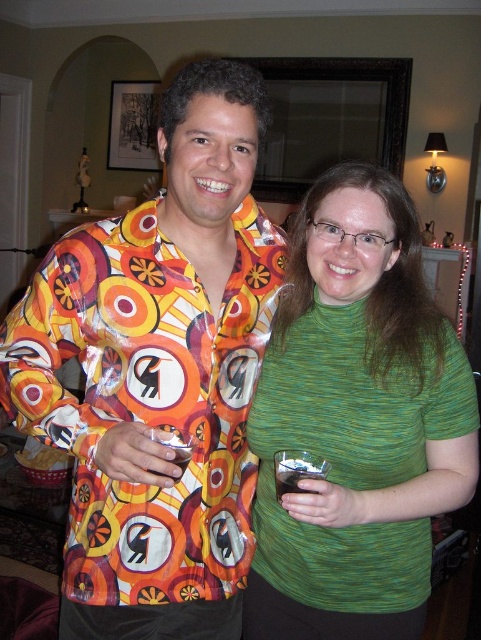
You are standing in the living room and want to find the green knit turtleneck at center. According to the coordinates provided, where should you look relative to the image frame?

The green knit turtleneck at center is located at coordinates point 0.659 on the x axis and 0.742 on the y axis relative to the image frame.

You are a photographer taking a picture of the green knit turtleneck at center and the transparent plastic wine glass at lower center. Which object is positioned closer to your camera lens?

The green knit turtleneck at center is closer to the viewer than the transparent plastic wine glass at lower center, so the green knit turtleneck at center is positioned closer to the camera lens.